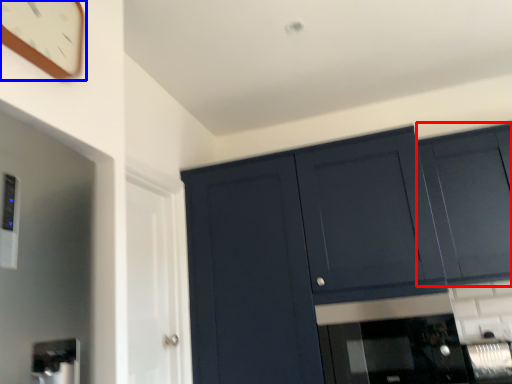
Question: Which of the following is the closest to the observer, cabinetry (highlighted by a red box) or clock (highlighted by a blue box)?

Choices:
 (A) cabinetry
 (B) clock

Answer: (B)